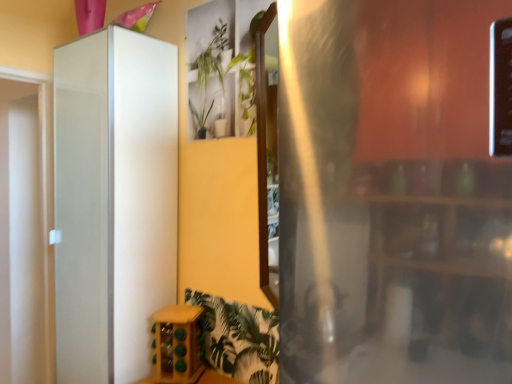
Question: Is the position of white glossy cabinet at left more distant than that of wooden wine rack at lower center?

Choices:
 (A) no
 (B) yes

Answer: (A)

Question: Is white glossy cabinet at left taller than wooden wine rack at lower center?

Choices:
 (A) yes
 (B) no

Answer: (A)

Question: From the image's perspective, is white glossy cabinet at left beneath wooden wine rack at lower center?

Choices:
 (A) yes
 (B) no

Answer: (B)

Question: Is white glossy cabinet at left positioned in front of wooden wine rack at lower center?

Choices:
 (A) no
 (B) yes

Answer: (B)

Question: From the image's perspective, is white glossy cabinet at left located above wooden wine rack at lower center?

Choices:
 (A) no
 (B) yes

Answer: (B)

Question: Is white glossy cabinet at left thinner than wooden wine rack at lower center?

Choices:
 (A) no
 (B) yes

Answer: (A)

Question: Would you say white glossy cabinet at left is outside green leafy plant at upper center?

Choices:
 (A) no
 (B) yes

Answer: (B)

Question: Is white glossy cabinet at left to the left of green leafy plant at upper center from the viewer's perspective?

Choices:
 (A) no
 (B) yes

Answer: (B)

Question: Is white glossy cabinet at left surrounding green leafy plant at upper center?

Choices:
 (A) no
 (B) yes

Answer: (A)

Question: Does white glossy cabinet at left lie in front of green leafy plant at upper center?

Choices:
 (A) no
 (B) yes

Answer: (A)

Question: From a real-world perspective, is white glossy cabinet at left positioned under green leafy plant at upper center based on gravity?

Choices:
 (A) no
 (B) yes

Answer: (B)

Question: Considering the relative sizes of white glossy cabinet at left and green leafy plant at upper center in the image provided, is white glossy cabinet at left bigger than green leafy plant at upper center?

Choices:
 (A) no
 (B) yes

Answer: (B)

Question: From a real-world perspective, is wooden wine rack at lower center located higher than white glossy cabinet at left?

Choices:
 (A) yes
 (B) no

Answer: (B)